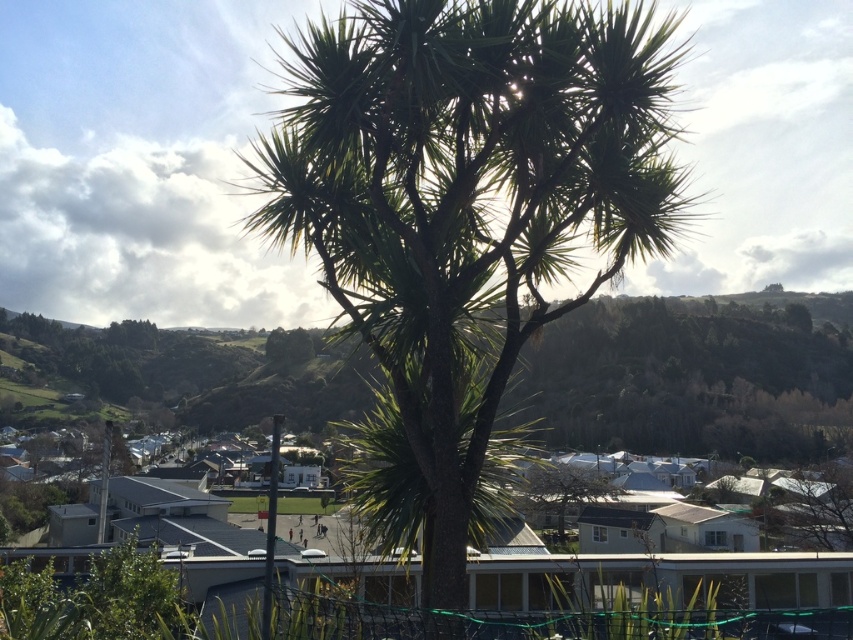
Does green leafy palm tree at center have a smaller size compared to green leafy tree at center?

Yes.

Which is behind, point (358, 296) or point (534, 483)?

The point (534, 483) is behind.

Identify the location of green leafy palm tree at center. (468, 198).